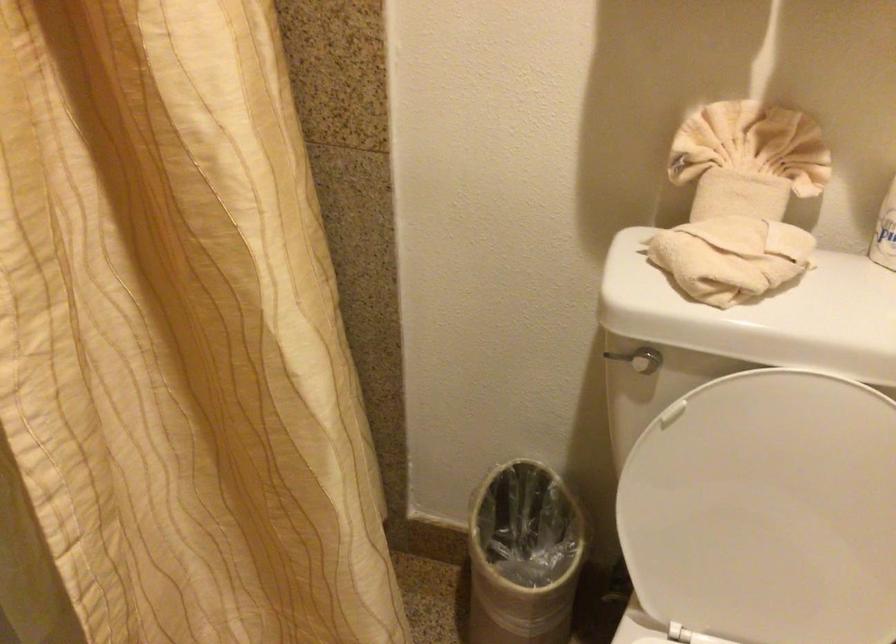
Find the location of a particular element. small trash can is located at coordinates (522, 556).